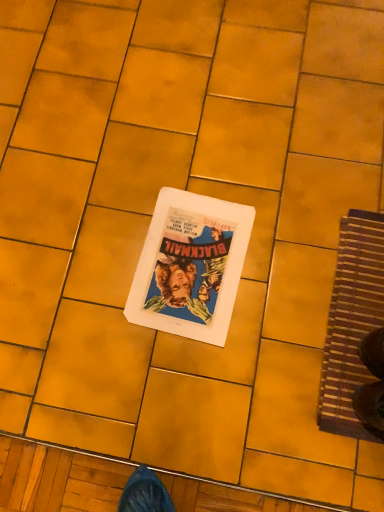
Question: Do you think brown woven mat at right is within white paper at center, or outside of it?

Choices:
 (A) inside
 (B) outside

Answer: (B)

Question: Is brown woven mat at right to the left or to the right of white paper at center in the image?

Choices:
 (A) right
 (B) left

Answer: (A)

Question: From a real-world perspective, is brown woven mat at right positioned above or below white paper at center?

Choices:
 (A) below
 (B) above

Answer: (A)

Question: Does point (175, 282) appear closer or farther from the camera than point (339, 314)?

Choices:
 (A) farther
 (B) closer

Answer: (A)

Question: From the image's perspective, relative to brown woven mat at right, is white paper at center above or below?

Choices:
 (A) below
 (B) above

Answer: (B)

Question: In terms of width, does white paper at center look wider or thinner when compared to brown woven mat at right?

Choices:
 (A) thin
 (B) wide

Answer: (A)

Question: Relative to brown woven mat at right, is white paper at center in front or behind?

Choices:
 (A) behind
 (B) front

Answer: (A)